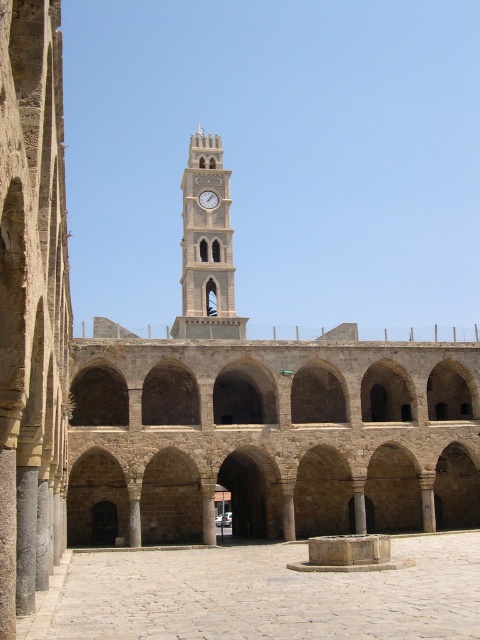
Question: Which point is farther to the camera?

Choices:
 (A) (214, 198)
 (B) (394, 627)
 (C) (190, 180)

Answer: (A)

Question: Which point is farther to the camera?

Choices:
 (A) (38, 616)
 (B) (210, 202)

Answer: (B)

Question: Where is smooth stone fountain at center located in relation to white stone clock tower at center in the image?

Choices:
 (A) right
 (B) left

Answer: (A)

Question: Does smooth stone fountain at center appear on the left side of metallic clock at center?

Choices:
 (A) no
 (B) yes

Answer: (A)

Question: Is smooth stone fountain at center thinner than metallic clock at center?

Choices:
 (A) no
 (B) yes

Answer: (A)

Question: Which point is closer to the camera?

Choices:
 (A) (200, 193)
 (B) (216, 241)
 (C) (405, 573)

Answer: (C)